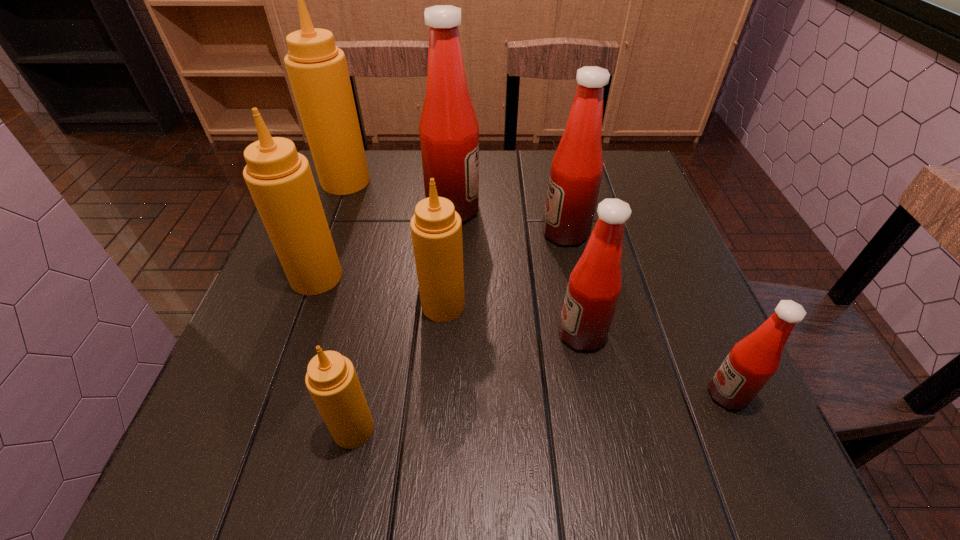
Where is `the sixth closest object relative to the third smallest tan condiment`? This screenshot has width=960, height=540. the sixth closest object relative to the third smallest tan condiment is located at coordinates (594, 286).

Where is `object that is the third closest to the third smallest tan condiment`? object that is the third closest to the third smallest tan condiment is located at coordinates (317, 69).

Identify which condiment is located as the sixth nearest to the biggest red condiment. Please provide its 2D coordinates. Your answer should be formatted as a tuple, i.e. [(x, y)], where the tuple contains the x and y coordinates of a point satisfying the conditions above.

[(331, 379)]

Where is `condiment that is the second nearest to the second biggest red condiment`? condiment that is the second nearest to the second biggest red condiment is located at coordinates (594, 286).

Select which tan condiment is the third closest to the leftmost red condiment. Please provide its 2D coordinates. Your answer should be formatted as a tuple, i.e. [(x, y)], where the tuple contains the x and y coordinates of a point satisfying the conditions above.

[(436, 228)]

Identify which tan condiment is the closest to the second biggest red condiment. Please provide its 2D coordinates. Your answer should be formatted as a tuple, i.e. [(x, y)], where the tuple contains the x and y coordinates of a point satisfying the conditions above.

[(436, 228)]

The width and height of the screenshot is (960, 540). Find the location of `red condiment that is the nearest to the third smallest red condiment`. red condiment that is the nearest to the third smallest red condiment is located at coordinates (449, 132).

The width and height of the screenshot is (960, 540). I want to click on red condiment that can be found as the second closest to the smallest tan condiment, so click(x=449, y=132).

This screenshot has height=540, width=960. Identify the location of free space that satisfies the following two spatial constraints: 1. on the front-facing side of the leftmost red condiment; 2. on the front side of the third biggest tan condiment. (446, 306).

Where is `vacant area in the image that satisfies the following two spatial constraints: 1. on the back side of the rightmost tan condiment; 2. on the left side of the second tan condiment from right to left`? Image resolution: width=960 pixels, height=540 pixels. vacant area in the image that satisfies the following two spatial constraints: 1. on the back side of the rightmost tan condiment; 2. on the left side of the second tan condiment from right to left is located at coordinates (379, 306).